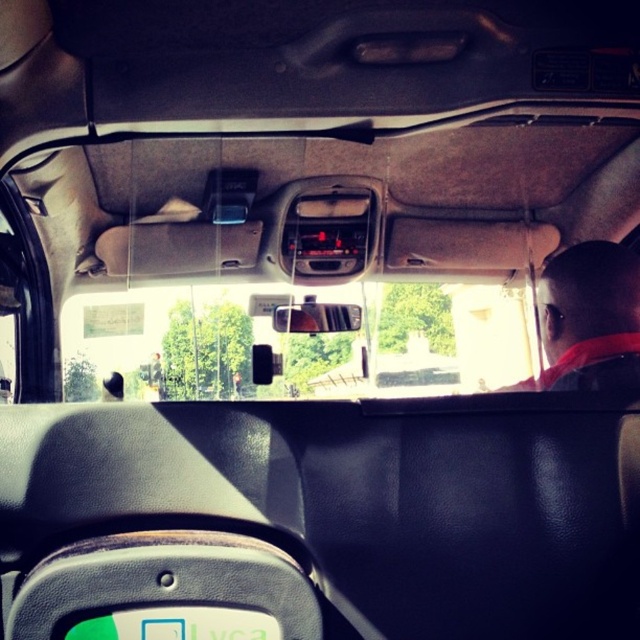
Who is higher up, dark gray fabric headrest at right or green matte license plate at lower center?

Positioned higher is dark gray fabric headrest at right.

Find the location of `dark gray fabric headrest at right`. dark gray fabric headrest at right is located at coordinates (586, 308).

Does point (536, 380) lie in front of point (253, 616)?

No, it is not.

Find the location of a particular element. The height and width of the screenshot is (640, 640). dark gray fabric headrest at right is located at coordinates (586, 308).

Could you measure the distance between green matte license plate at lower center and clear plastic view mirror at center?

The distance of green matte license plate at lower center from clear plastic view mirror at center is 3.24 meters.

This screenshot has width=640, height=640. What are the coordinates of `green matte license plate at lower center` in the screenshot? It's located at (177, 625).

Consider the image. Can you confirm if dark gray fabric headrest at right is shorter than clear plastic view mirror at center?

Incorrect, dark gray fabric headrest at right's height does not fall short of clear plastic view mirror at center's.

Who is positioned more to the left, dark gray fabric headrest at right or clear plastic view mirror at center?

From the viewer's perspective, clear plastic view mirror at center appears more on the left side.

The width and height of the screenshot is (640, 640). I want to click on dark gray fabric headrest at right, so click(586, 308).